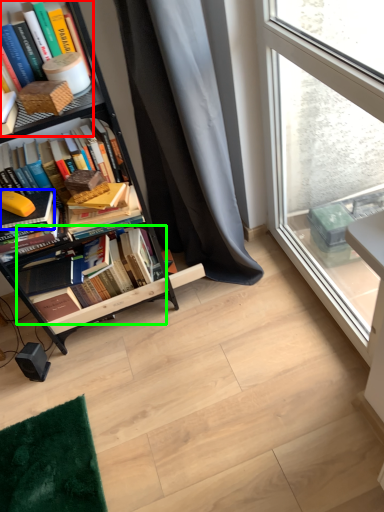
Question: Based on their relative distances, which object is farther from book (highlighted by a red box)? Choose from book (highlighted by a blue box) and book (highlighted by a green box).

Choices:
 (A) book
 (B) book

Answer: (B)